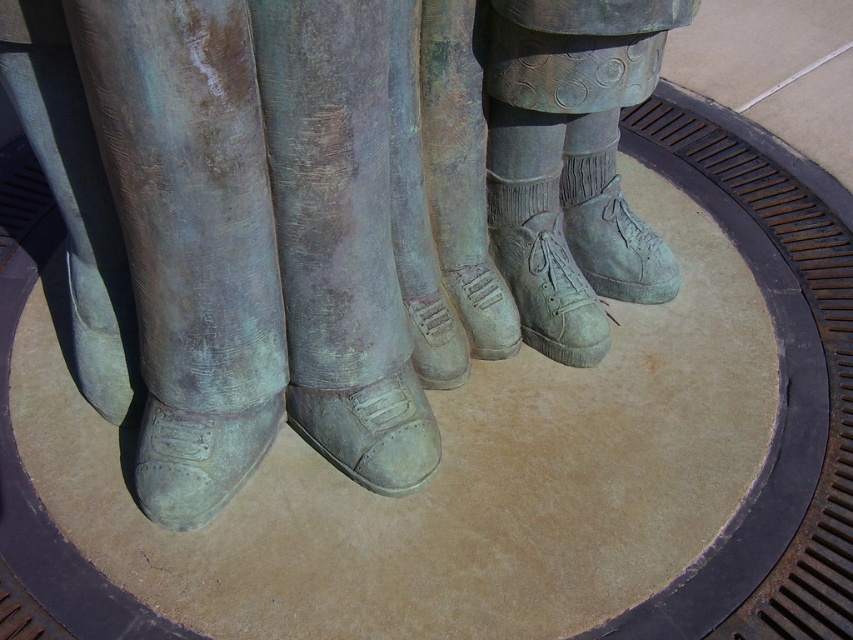
Can you confirm if green patina boot at center is positioned to the right of matte green boot at center?

Incorrect, green patina boot at center is not on the right side of matte green boot at center.

Who is positioned more to the left, green patina boot at center or matte green boot at center?

green patina boot at center is more to the left.

Is point (361, 435) closer to viewer compared to point (489, 225)?

Yes, it is in front of point (489, 225).

Locate an element on the screen. This screenshot has height=640, width=853. green patina boot at center is located at coordinates coord(370,429).

Is bronze shoes at center behind green patina boot at center?

No, it is in front of green patina boot at center.

Is bronze shoes at center bigger than green patina boot at center?

Yes.

Is point (120, 396) less distant than point (434, 435)?

No, (120, 396) is behind (434, 435).

Identify the location of bronze shoes at center. This screenshot has width=853, height=640. (314, 211).

What do you see at coordinates (370, 429) in the screenshot?
I see `green patina boot at center` at bounding box center [370, 429].

Does green patina boot at center lie in front of green suede boot at center?

Yes.

You are a GUI agent. You are given a task and a screenshot of the screen. Output one action in this format:
    pyautogui.click(x=<x>, y=<y>)
    Task: Click on the green patina boot at center
    This screenshot has height=640, width=853.
    Given the screenshot: What is the action you would take?
    pyautogui.click(x=370, y=429)